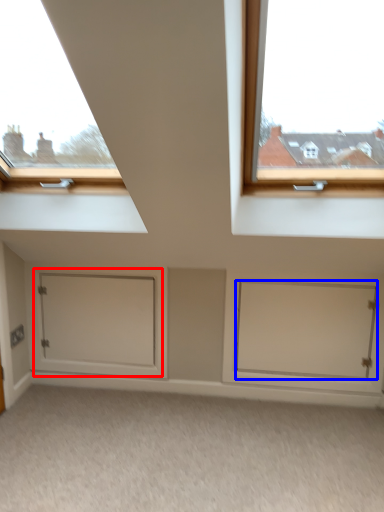
Question: Which of the following is the farthest to the observer, door (highlighted by a red box) or door (highlighted by a blue box)?

Choices:
 (A) door
 (B) door

Answer: (A)